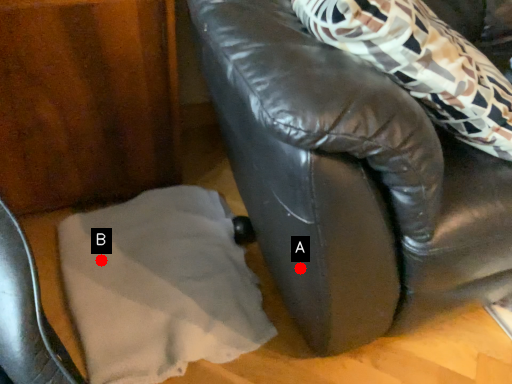
Question: Two points are circled on the image, labeled by A and B beside each circle. Which point appears farthest from the camera in this image?

Choices:
 (A) A is further
 (B) B is further

Answer: (B)